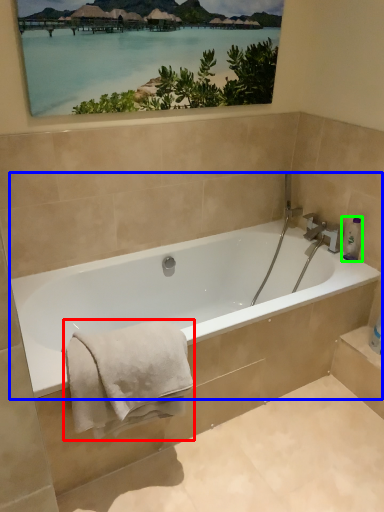
Question: Based on their relative distances, which object is nearer to bath towel (highlighted by a red box)? Choose from bathtub (highlighted by a blue box) and toiletry (highlighted by a green box).

Choices:
 (A) bathtub
 (B) toiletry

Answer: (A)